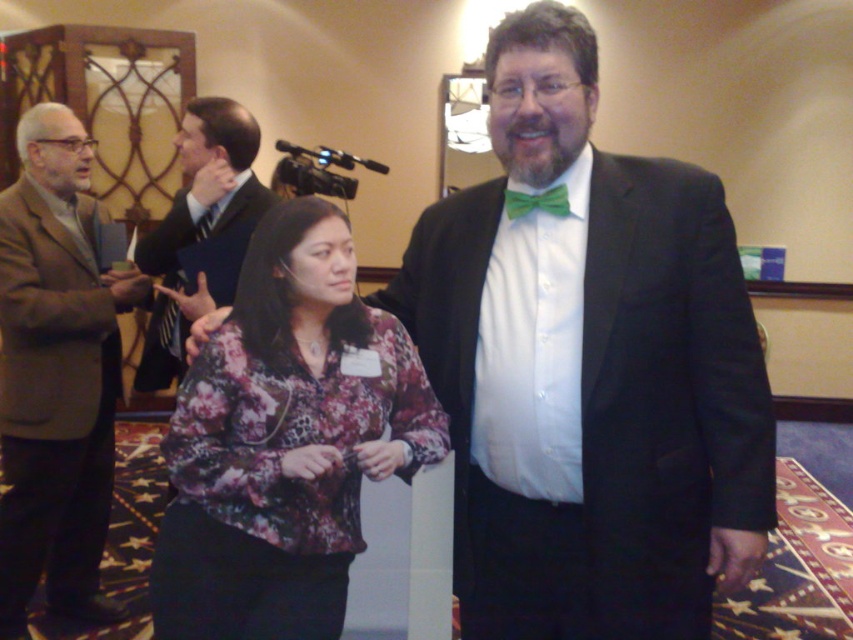
Is point (68, 436) positioned after point (201, 225)?

No, it is not.

What do you see at coordinates (56, 376) in the screenshot? The height and width of the screenshot is (640, 853). I see `brown woolen suit at left` at bounding box center [56, 376].

Describe the element at coordinates (56, 376) in the screenshot. The image size is (853, 640). I see `brown woolen suit at left` at that location.

Where is `brown woolen suit at left`? The height and width of the screenshot is (640, 853). brown woolen suit at left is located at coordinates (56, 376).

Is dark blue sweater at center below dark gray suit at center?

Actually, dark blue sweater at center is above dark gray suit at center.

Does dark blue sweater at center have a lesser width compared to dark gray suit at center?

In fact, dark blue sweater at center might be wider than dark gray suit at center.

Describe the element at coordinates (200, 230) in the screenshot. The width and height of the screenshot is (853, 640). I see `dark blue sweater at center` at that location.

The height and width of the screenshot is (640, 853). Find the location of `dark blue sweater at center`. dark blue sweater at center is located at coordinates (200, 230).

Who is higher up, brown woolen suit at left or dark gray suit at center?

Positioned higher is dark gray suit at center.

Who is positioned more to the left, brown woolen suit at left or dark gray suit at center?

From the viewer's perspective, brown woolen suit at left appears more on the left side.

Where is `brown woolen suit at left`? This screenshot has width=853, height=640. brown woolen suit at left is located at coordinates (56, 376).